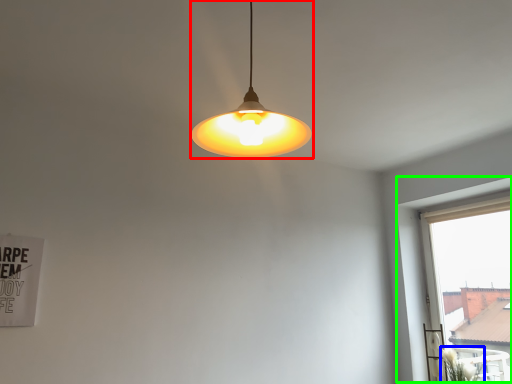
Question: Considering the real-world distances, which object is farthest from lamp (highlighted by a red box)? plant (highlighted by a blue box) or window (highlighted by a green box)?

Choices:
 (A) plant
 (B) window

Answer: (A)